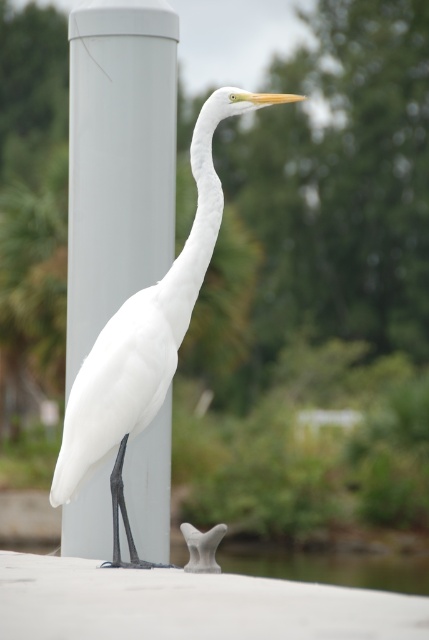
You are a photographer trying to capture the Great Egret on the white smooth pole at center. You notice another white matte bird at center nearby. Which object is narrower when viewed from your camera lens?

The white smooth pole at center is thinner than the white matte bird at center, so the white smooth pole at center appears narrower when viewed from the camera lens.

You are a photographer adjusting your camera settings to focus on two specific points in the image. The first point is labeled as point (99,524) and the second as point (115,461). Since you can only focus on one point at a time, which point should you choose to ensure the Great Egret is in focus?

You should focus on point (99,524) because it is closer to the camera than point (115,461), ensuring the Great Egret is in focus.

The scene shows a Great Egret on a white cylindrical post. There is a point at coordinates (117, 160). What object is this point located on?

The point at coordinates (117, 160) is located on the white smooth pole at center.